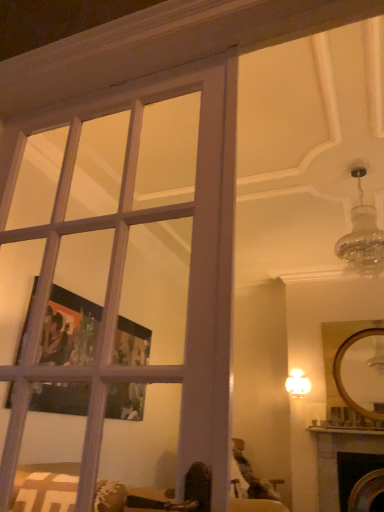
What are the coordinates of `clear crystal chandelier at upper right` in the screenshot? It's located at [362, 236].

This screenshot has width=384, height=512. What do you see at coordinates (362, 236) in the screenshot?
I see `clear crystal chandelier at upper right` at bounding box center [362, 236].

Find the location of a particular element. clear crystal chandelier at upper right is located at coordinates (362, 236).